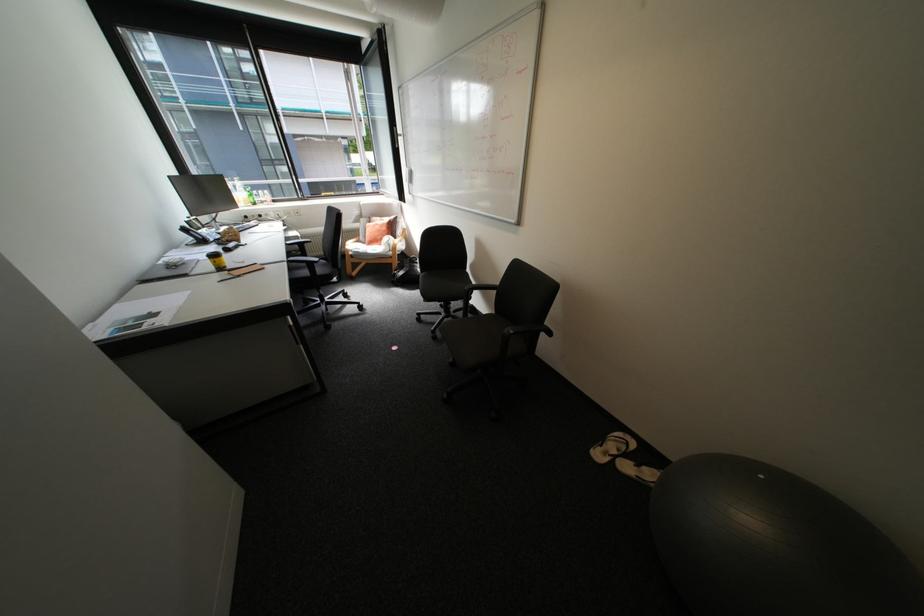
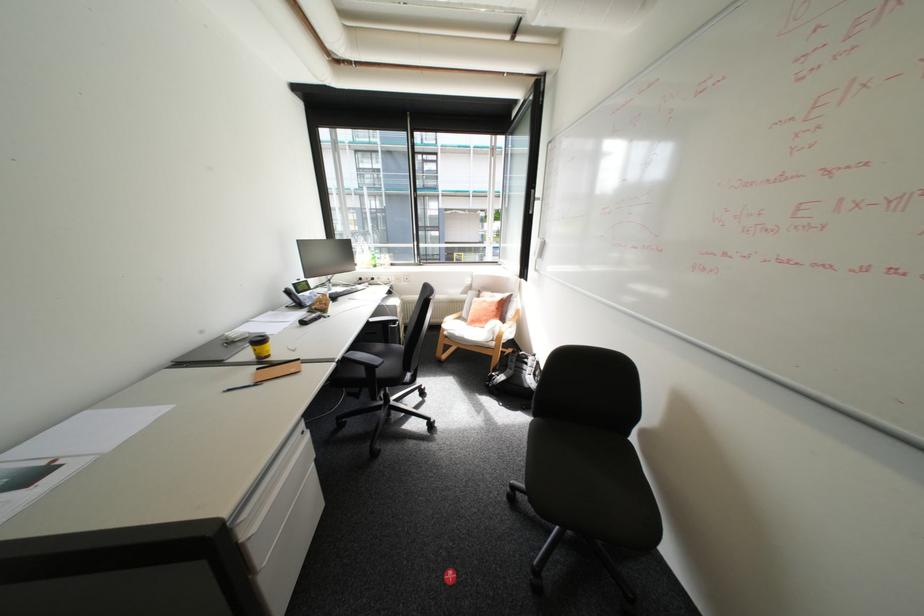
Question: Which direction would the cameraman need to move to produce the second image? Reply with the corresponding letter.

Choices:
 (A) Left
 (B) Right
 (C) Forward
 (D) Backward

Answer: (C)